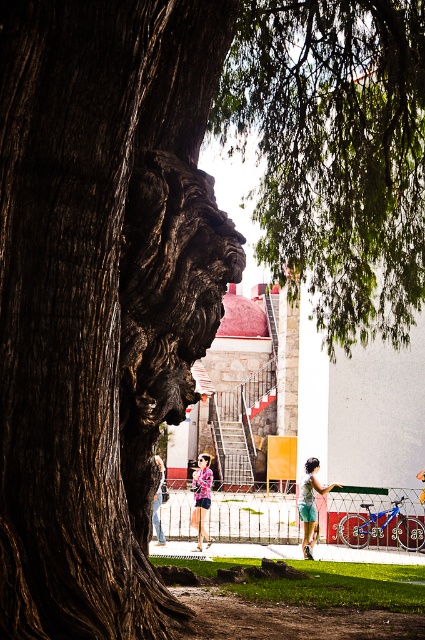
You are standing in front of the large tree trunk on the left. You want to place a small birdhouse exactly where the green leafy tree at upper center is located. What are the coordinates you should aim for?

The coordinates for the green leafy tree at upper center are 0.241 in the x direction and 0.791 in the y direction.

You are standing in front of the large tree trunk with the carved lion head. You notice two points marked on the ground in front of you. The first point is at coordinates point [308,538] and the second is at point [201,541]. Which point is closer to you?

Point [308,538] is closer to the viewer than point [201,541].